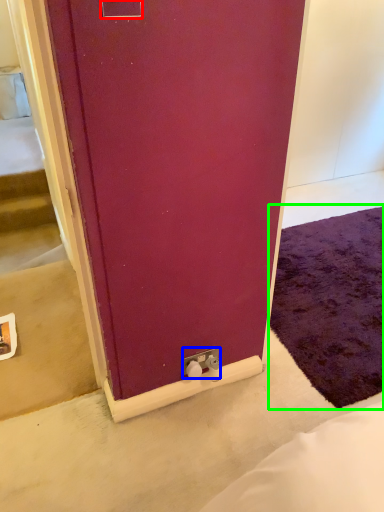
Question: Which object is positioned closest to electric outlet (highlighted by a red box)? Select from electric outlet (highlighted by a blue box) and doormat (highlighted by a green box).

Choices:
 (A) electric outlet
 (B) doormat

Answer: (A)